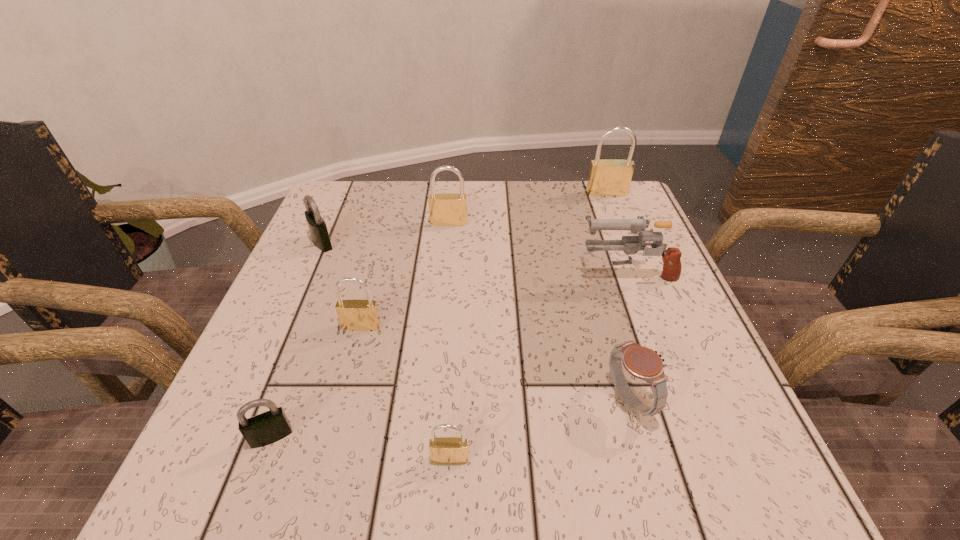
At what (x,y) coordinates should I click in order to perform the action: click on free spot between the nearest brass padlock and the farthest padlock. Please return your answer as a coordinate pair (x, y). Image resolution: width=960 pixels, height=540 pixels. Looking at the image, I should click on (528, 326).

This screenshot has width=960, height=540. Identify the location of free space between the nearest object and the third padlock from left to right. pos(406,393).

Identify the location of object that is the fifth closest to the fifth nearest padlock. The width and height of the screenshot is (960, 540). (641, 362).

Locate which object ranks fifth in proximity to the fifth nearest object. Please provide its 2D coordinates. Your answer should be formatted as a tuple, i.e. [(x, y)], where the tuple contains the x and y coordinates of a point satisfying the conditions above.

[(445, 450)]

Where is `the third closest padlock to the gray watch`? the third closest padlock to the gray watch is located at coordinates (446, 209).

Identify the location of the fifth closest padlock to the third farthest brass padlock. Image resolution: width=960 pixels, height=540 pixels. (611, 177).

You are a GUI agent. You are given a task and a screenshot of the screen. Output one action in this format:
    pyautogui.click(x=<x>, y=<y>)
    Task: Click on the brass padlock that stands as the closest to the smallest brass padlock
    This screenshot has width=960, height=540.
    Given the screenshot: What is the action you would take?
    pyautogui.click(x=354, y=315)

The height and width of the screenshot is (540, 960). I want to click on the third closest brass padlock to the fourth farthest object, so click(x=354, y=315).

Find the location of a particular element. vacant point that satisfies the following two spatial constraints: 1. at the barrel end of the gun; 2. on the front-facing side of the fifth farthest object is located at coordinates (647, 327).

The height and width of the screenshot is (540, 960). I want to click on free spot that satisfies the following two spatial constraints: 1. on the front-facing side of the gray watch; 2. on the right side of the second tallest padlock, so click(x=433, y=400).